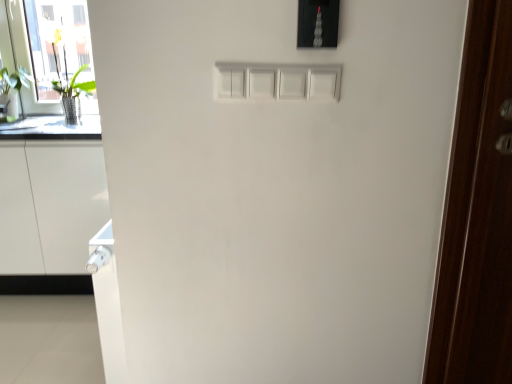
Question: Can you confirm if white glossy cabinet at lower left is wider than green leafy plant at left?

Choices:
 (A) yes
 (B) no

Answer: (A)

Question: Can you confirm if white glossy cabinet at lower left is positioned to the left of green leafy plant at left?

Choices:
 (A) no
 (B) yes

Answer: (A)

Question: Does white glossy cabinet at lower left have a lesser height compared to green leafy plant at left?

Choices:
 (A) no
 (B) yes

Answer: (A)

Question: From the image's perspective, is white glossy cabinet at lower left over green leafy plant at left?

Choices:
 (A) no
 (B) yes

Answer: (A)

Question: Does white glossy cabinet at lower left have a larger size compared to green leafy plant at left?

Choices:
 (A) yes
 (B) no

Answer: (A)

Question: From a real-world perspective, does white glossy cabinet at lower left stand above green leafy plant at left?

Choices:
 (A) yes
 (B) no

Answer: (B)

Question: From a real-world perspective, is dark wood door at right below transparent glass door at left?

Choices:
 (A) yes
 (B) no

Answer: (A)

Question: Is dark wood door at right behind transparent glass door at left?

Choices:
 (A) yes
 (B) no

Answer: (B)

Question: Does dark wood door at right turn towards transparent glass door at left?

Choices:
 (A) yes
 (B) no

Answer: (B)

Question: From a real-world perspective, is dark wood door at right located higher than transparent glass door at left?

Choices:
 (A) yes
 (B) no

Answer: (B)

Question: Is dark wood door at right thinner than transparent glass door at left?

Choices:
 (A) yes
 (B) no

Answer: (A)

Question: Considering the relative sizes of dark wood door at right and transparent glass door at left in the image provided, is dark wood door at right bigger than transparent glass door at left?

Choices:
 (A) yes
 (B) no

Answer: (B)

Question: Can you confirm if dark wood door at right is thinner than satin black light switch at upper center?

Choices:
 (A) yes
 (B) no

Answer: (B)